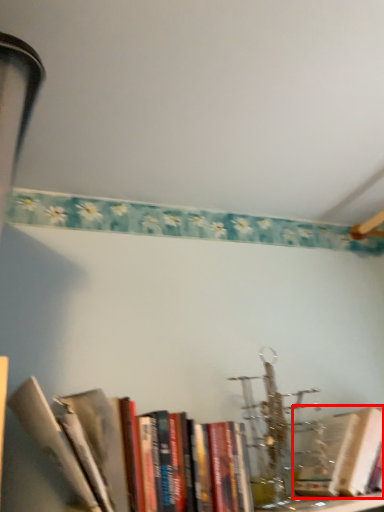
Question: Where is book (annotated by the red box) located in relation to book in the image?

Choices:
 (A) left
 (B) right

Answer: (B)